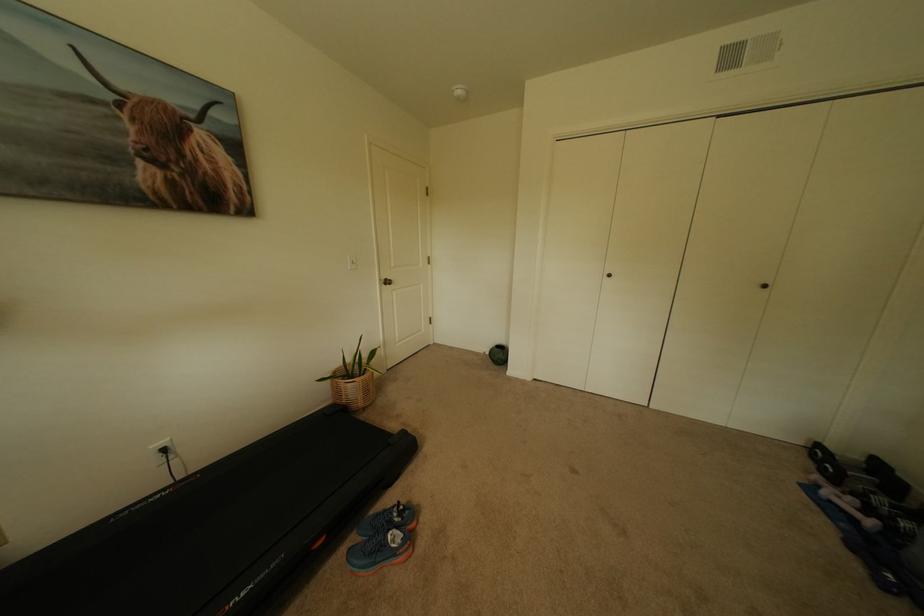
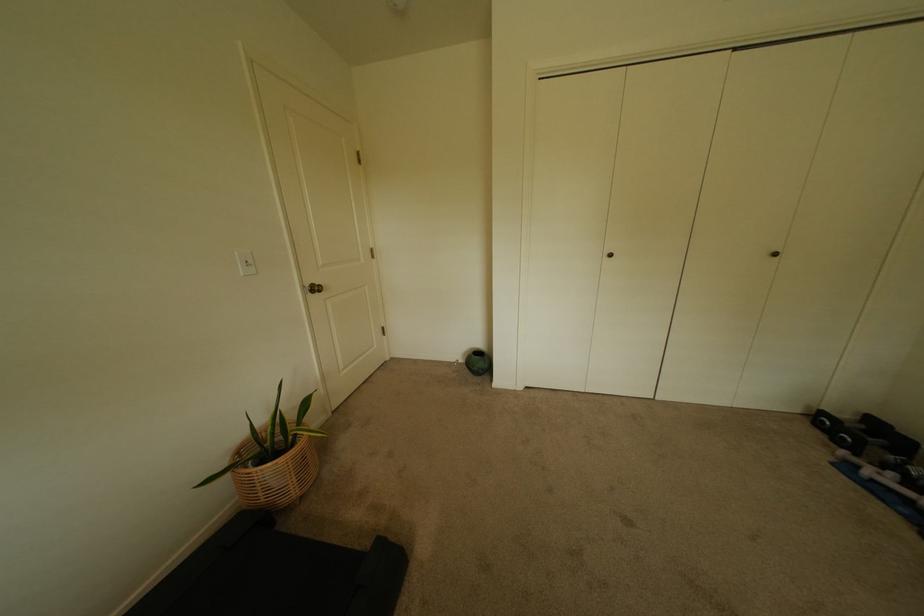
Find the pixel in the second image that matches point 370,395 in the first image.

(302, 480)